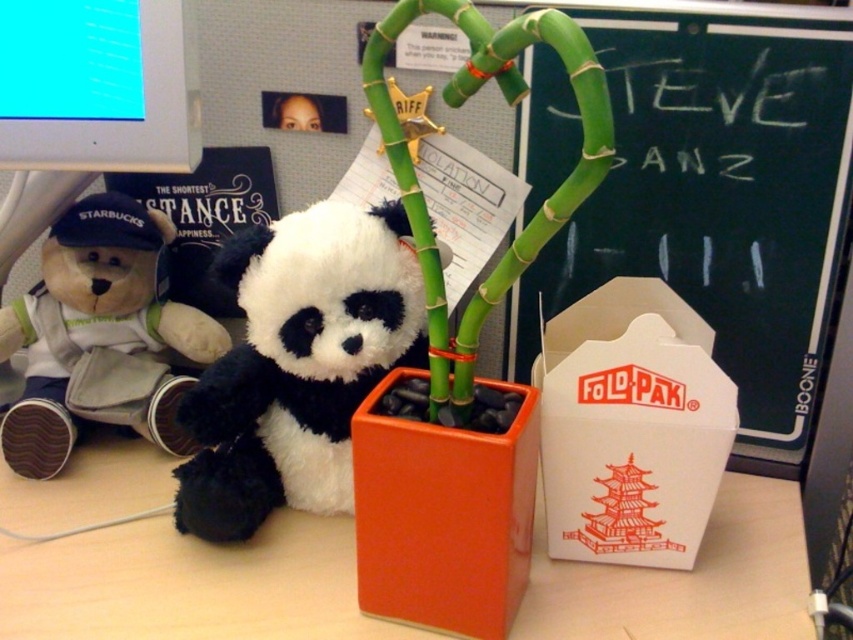
You are standing at the point marked as point (265, 483) on the desk. You want to reach the computer monitor in the background. Can you estimate how far you need to move forward to reach it?

The point marked as point (265, 483) is 29.48 inches away from the viewer, so you need to move forward approximately 29.48 inches to reach the computer monitor in the background.

You are organizing the desk and need to place a new item between the brown plush bear at left and the green bamboo at center. Considering their widths, which object should you place closer to the edge to ensure the new item fits snugly?

The brown plush bear at left is wider than the green bamboo at center. To fit the new item snugly, place the brown plush bear at left closer to the edge since it takes up more space.

You are organizing the desk and need to place a new item between the soft plush panda at center and the brown plush bear at left. Given their sizes, which one should you place closer to the edge to ensure the new item fits comfortably?

The soft plush panda at center has a smaller width than the brown plush bear at left, so placing the brown plush bear at left closer to the edge would allow more space for the new item between them.